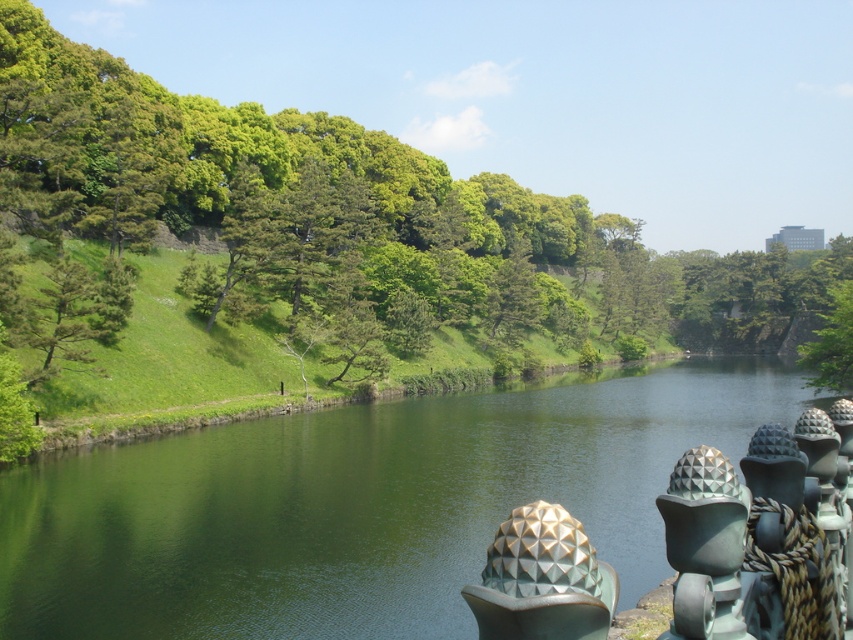
Who is positioned more to the left, green smooth water at center or green leafy tree at center?

From the viewer's perspective, green smooth water at center appears more on the left side.

Is point (413, 513) positioned after point (334, 211)?

No, (413, 513) is in front of (334, 211).

Describe the element at coordinates (357, 506) in the screenshot. I see `green smooth water at center` at that location.

Locate an element on the screen. The image size is (853, 640). green smooth water at center is located at coordinates (357, 506).

Can you confirm if green smooth water at center is wider than green leafy tree at center-right?

Incorrect, green smooth water at center's width does not surpass green leafy tree at center-right's.

Is point (258, 445) more distant than point (813, 369)?

No, (258, 445) is closer to viewer.

Locate an element on the screen. This screenshot has height=640, width=853. green smooth water at center is located at coordinates point(357,506).

Between polished bronze sphere at lower right and green leafy tree at center-right, which one has more height?

With more height is green leafy tree at center-right.

Is polished bronze sphere at lower right in front of green leafy tree at center-right?

Yes.

Which is behind, point (581, 541) or point (828, 353)?

The point (828, 353) is behind.

The width and height of the screenshot is (853, 640). I want to click on polished bronze sphere at lower right, so click(543, 579).